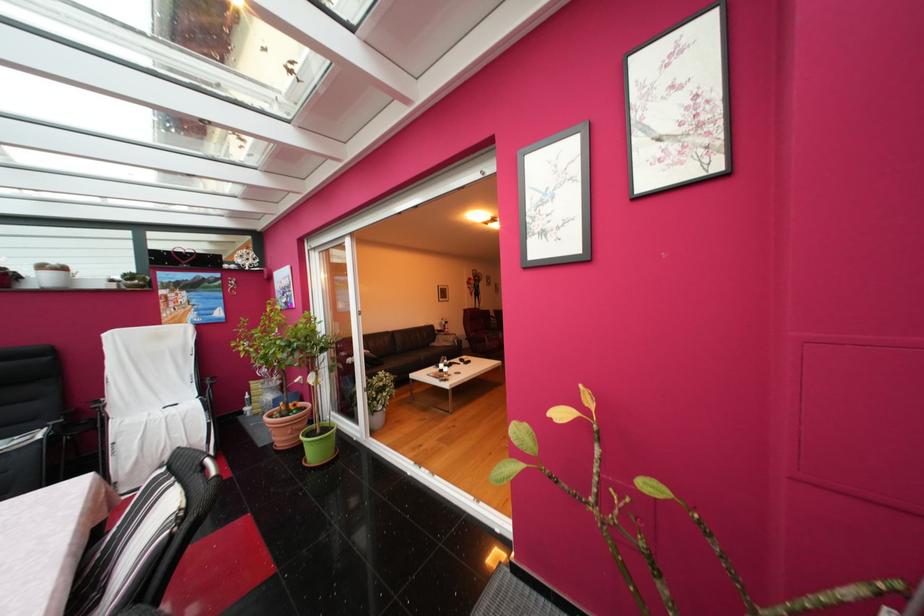
At what (x,y) coordinates should I click in order to perform the action: click on sofa sitting surface. Please return your answer as a coordinate pair (x, y). The image size is (924, 616). Looking at the image, I should click on (397, 363).